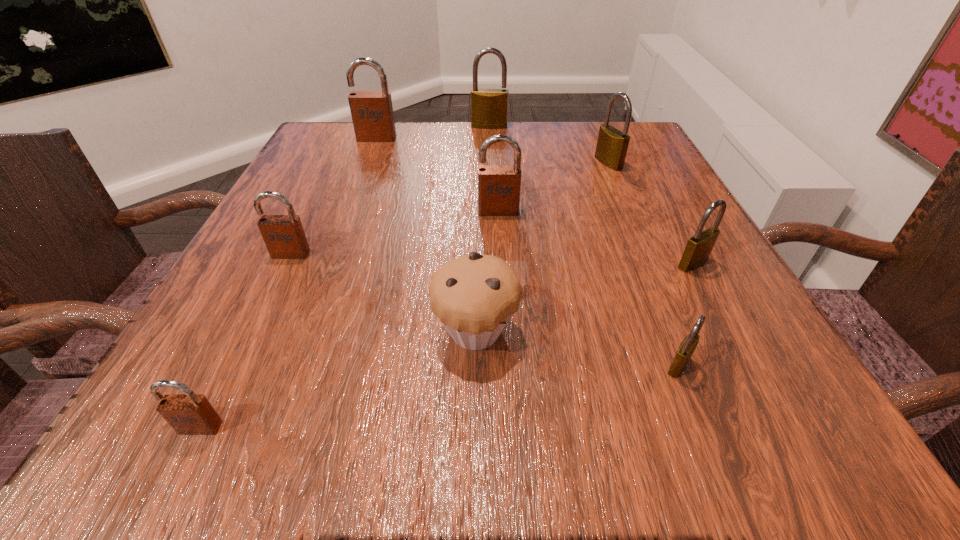
Locate an element on the screen. This screenshot has height=540, width=960. vacant space situated 0.220m on the front-facing side of the second nearest brown padlock is located at coordinates (233, 372).

Where is `vacant space located on the back of the rightmost brass padlock`? vacant space located on the back of the rightmost brass padlock is located at coordinates (652, 187).

At what (x,y) coordinates should I click in order to perform the action: click on vacant space situated on the right of the muffin. Please return your answer as a coordinate pair (x, y). The height and width of the screenshot is (540, 960). Looking at the image, I should click on tap(620, 332).

Locate an element on the screen. The height and width of the screenshot is (540, 960). vacant space located 0.250m on the back of the nearest brass padlock is located at coordinates (628, 237).

Where is `object at the near edge`? The width and height of the screenshot is (960, 540). object at the near edge is located at coordinates (188, 414).

Image resolution: width=960 pixels, height=540 pixels. What are the coordinates of `object that is positioned at the far left corner` in the screenshot? It's located at (372, 114).

Find the location of a particular element. object that is at the near left corner is located at coordinates point(188,414).

Where is `object positioned at the far right corner`? The height and width of the screenshot is (540, 960). object positioned at the far right corner is located at coordinates (611, 149).

Locate an element on the screen. The width and height of the screenshot is (960, 540). free space at the far edge is located at coordinates (437, 151).

Identify the location of vacant space at the near edge of the desktop. (564, 395).